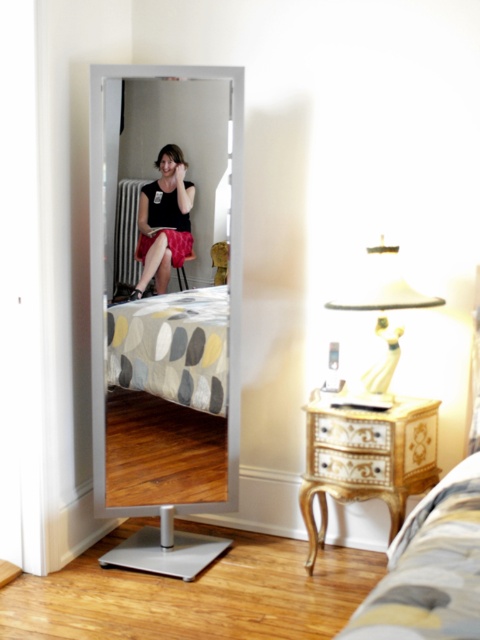
In the scene shown: You are a photographer adjusting your camera settings in the bedroom scene. You notice two points marked in the image. Which of these points, point (x=402, y=579) or point (x=362, y=451), is closer to your camera lens?

Point (x=402, y=579) is closer to the camera lens than point (x=362, y=451).

You are a guest in this bedroom and want to place a tall lamp on the furniture that can accommodate its height. Which furniture item between the striped fabric bed at lower right and the gold ornate dresser at lower right should you choose?

The gold ornate dresser at lower right is taller than the striped fabric bed at lower right, so you should choose the gold ornate dresser at lower right to place the tall lamp.

You are standing in the bedroom and want to place a new lamp on the striped fabric bed at lower right. To reach it, you need to move around the gold ornate dresser at lower right. Based on their positions, which side of the dresser should you go around to access the bed?

Since the striped fabric bed at lower right is to the left of the gold ornate dresser at lower right, you should go around the left side of the dresser to reach the bed.